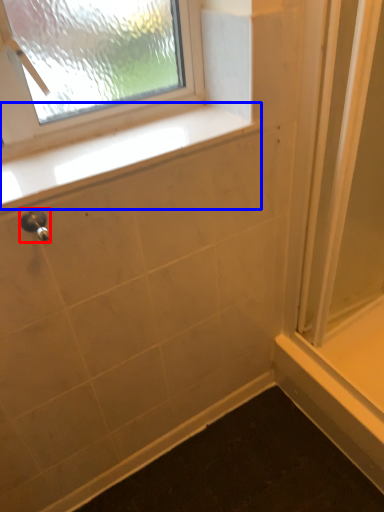
Question: Which object is further to the camera taking this photo, shower (highlighted by a red box) or window sill (highlighted by a blue box)?

Choices:
 (A) shower
 (B) window sill

Answer: (B)